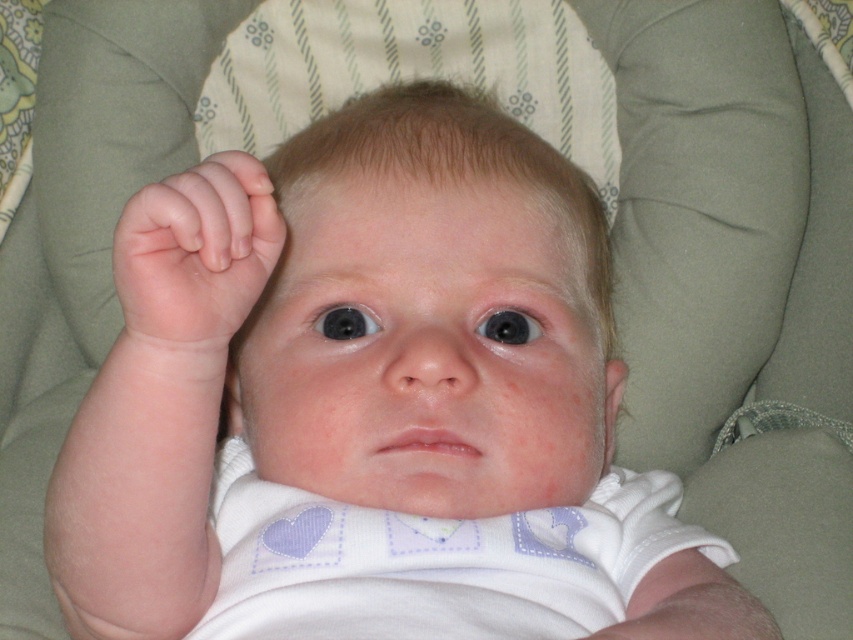
Can you confirm if smooth skin head at center is positioned to the left of pink flesh-toned hand at upper left?

In fact, smooth skin head at center is to the right of pink flesh-toned hand at upper left.

Locate an element on the screen. Image resolution: width=853 pixels, height=640 pixels. smooth skin head at center is located at coordinates (430, 314).

This screenshot has width=853, height=640. What do you see at coordinates (430, 314) in the screenshot?
I see `smooth skin head at center` at bounding box center [430, 314].

Identify the location of smooth skin head at center. (430, 314).